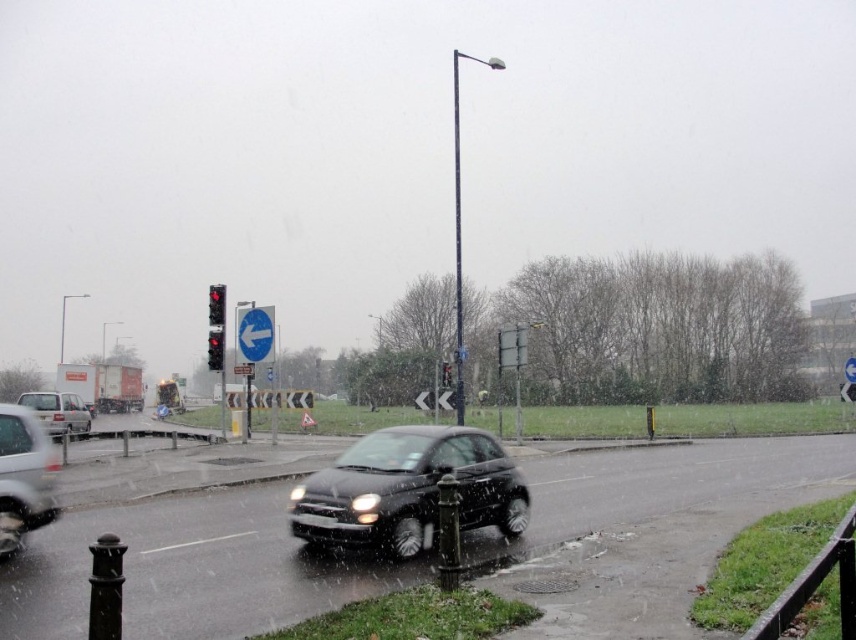
You are a pedestrian standing on the sidewalk of the rainy urban street scene. You see a point marked at coordinates point [254,333]. What object is located at that point?

The point [254,333] corresponds to the white plastic sign at upper center.

You are a pedestrian standing at the crosswalk near the red glass traffic light at upper center and the metallic traffic light at center. You want to cross the street safely. The crosswalk is between these two traffic lights. If the distance between them is exactly 10.05 meters, and the safe crossing distance for pedestrians is 10 meters, can you safely cross the street without stopping?

The distance between the red glass traffic light at upper center and the metallic traffic light at center is 10.05 meters. Since the safe crossing distance is 10 meters, you cannot safely cross the street without stopping because the distance exceeds the recommended safe limit by 0.05 meters.